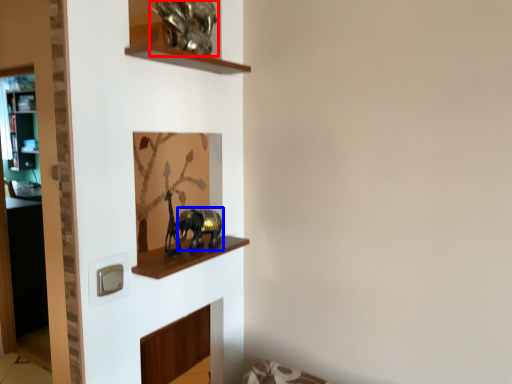
Question: Which object is further to the camera taking this photo, animal (highlighted by a red box) or animal (highlighted by a blue box)?

Choices:
 (A) animal
 (B) animal

Answer: (B)